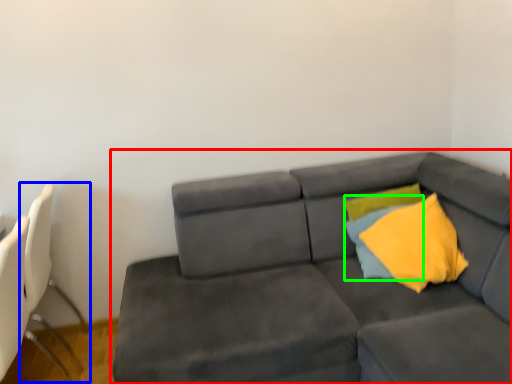
Question: Which object is the closest to the studio couch (highlighted by a red box)? Choose among these: swivel chair (highlighted by a blue box) or pillow (highlighted by a green box).

Choices:
 (A) swivel chair
 (B) pillow

Answer: (B)